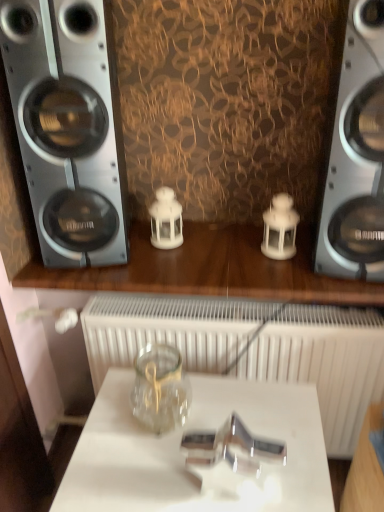
Locate an element on the screen. The height and width of the screenshot is (512, 384). free space above transparent glass jar at center (from a real-world perspective) is located at coordinates (200, 429).